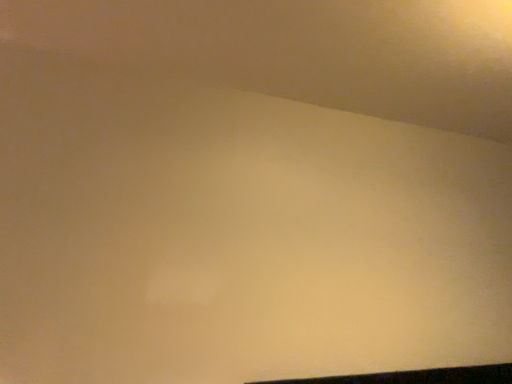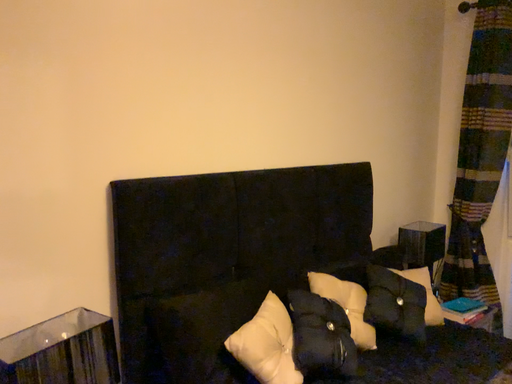
Question: How did the camera likely rotate when shooting the video?

Choices:
 (A) rotated left
 (B) rotated right

Answer: (B)